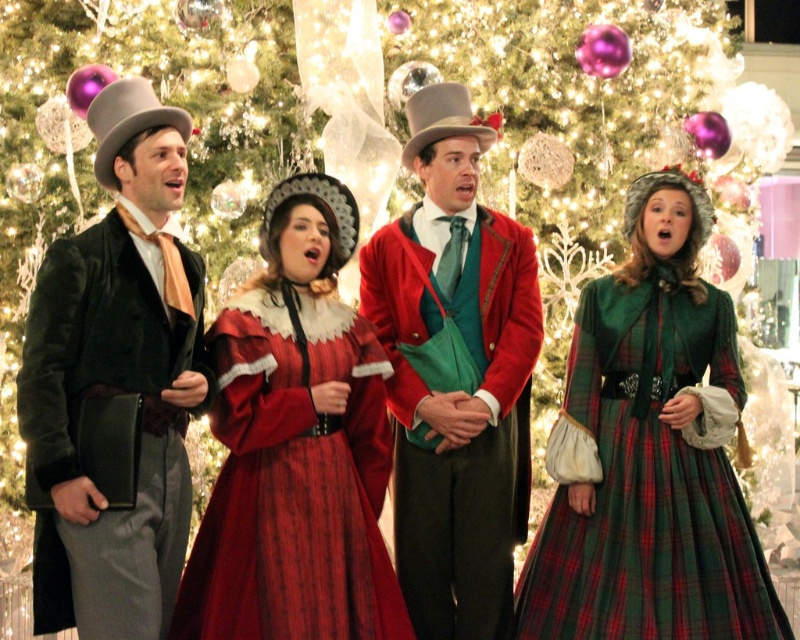
In the festive scene with a Christmas tree and four people in period costumes, there is a velvet red coat at center and a matte gray dress hat at center. Which one is positioned lower from the ground?

The velvet red coat at center is below the matte gray dress hat at center, so the velvet red coat at center is positioned lower from the ground.

Looking at this image, you are a photographer setting up for a group photo. You have a wide aperture lens that can focus on objects up to 30 cm wide. You need to decide whether both the velvet red coat at center and the matte gray dress hat at center will fit within the focus area. Can you confirm if both items are within the 30 cm width limit?

The velvet red coat at center might be wider than matte gray dress hat at center. Since the velvet red coat at center might exceed 30 cm in width, it is uncertain if both will fit within the focus area. Check the actual width before finalizing.